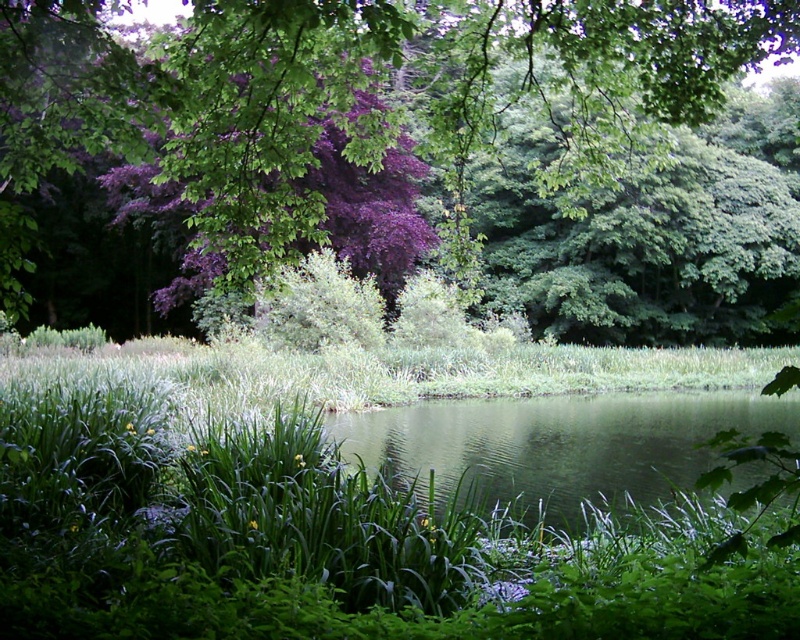
From the picture: You are a painter standing at the edge of the water, looking at the purple leafy tree at upper center and the green liquid at center. Which object is larger in size?

The purple leafy tree at upper center is bigger than the green liquid at center.

You are a bird flying over the scene and want to land on the purple leafy tree at upper center. Can you see the green liquid at center from your landing spot?

Yes, because the purple leafy tree at upper center is above the green liquid at center, so the bird can see it from above.